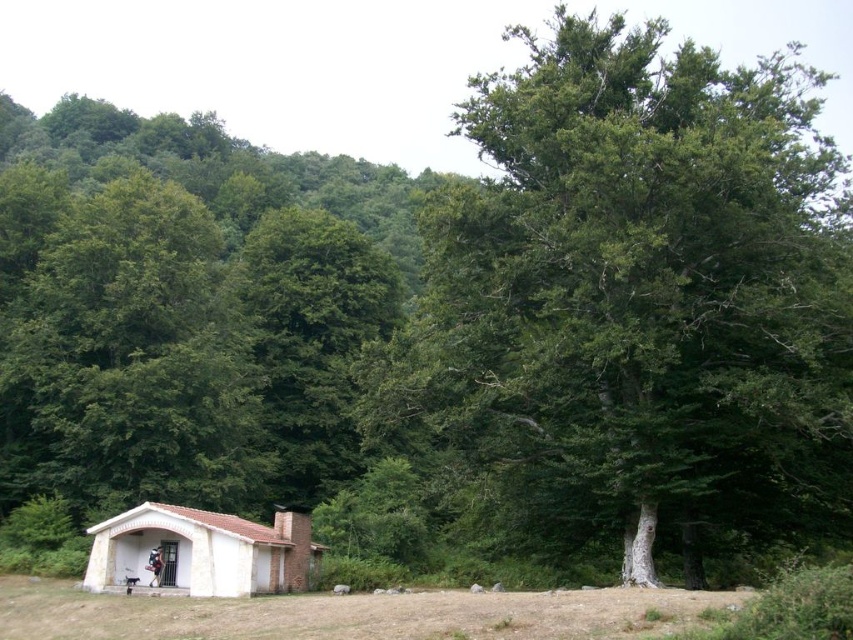
You are planning to build a small garden between the green leafy tree at center and the white brick hut at lower left. Considering their sizes, which object occupies more horizontal space and would require more clearance?

The green leafy tree at center has a larger width than the white brick hut at lower left, so it occupies more horizontal space and would require more clearance.

You are planning to build a new shed in this rural area. The shed will be the same size as the white brick hut at lower left. Can you fit it between the green leafy tree at center and the edge of the grassy area without overlapping them?

The green leafy tree at center is bigger than the white brick hut at lower left. Since the shed will be the same size as the white brick hut at lower left, it should fit between the green leafy tree at center and the edge of the grassy area as long as there is sufficient space. However, the exact feasibility depends on the actual dimensions of the area not specified here.